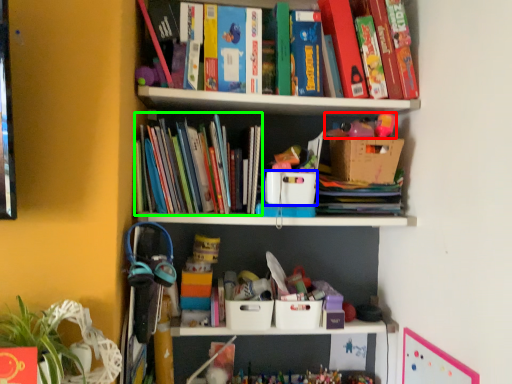
Question: Considering the real-world distances, which object is closest to toy (highlighted by a red box)? storage box (highlighted by a blue box) or book (highlighted by a green box).

Choices:
 (A) storage box
 (B) book

Answer: (A)